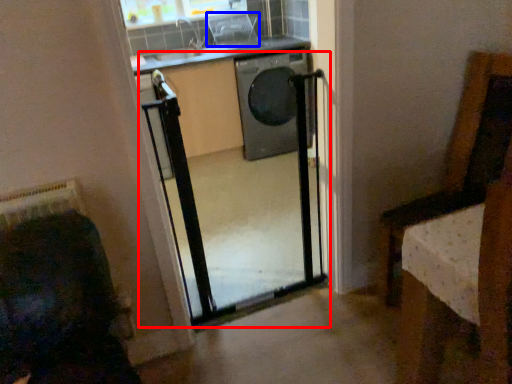
Question: Which object appears farthest to the camera in this image, screen door (highlighted by a red box) or armchair (highlighted by a blue box)?

Choices:
 (A) screen door
 (B) armchair

Answer: (B)